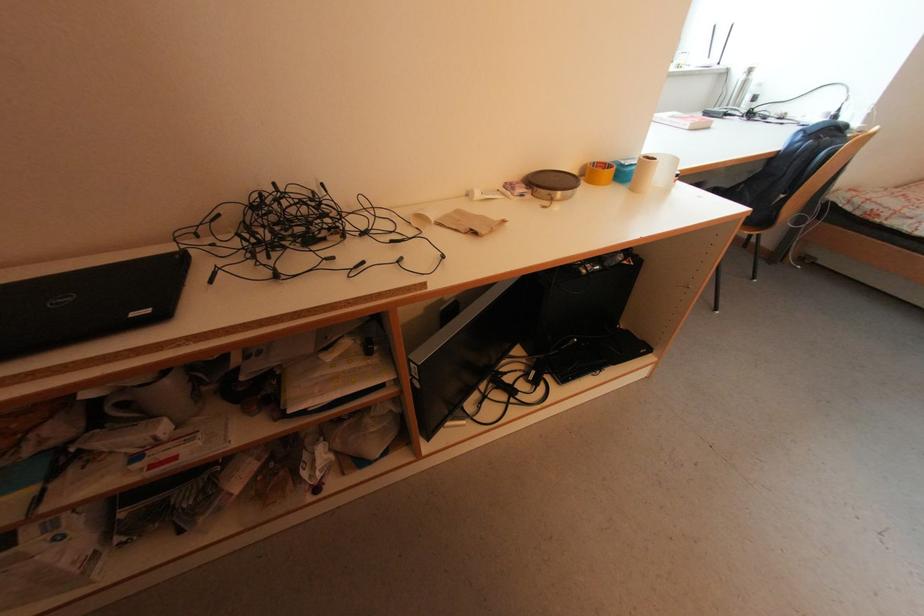
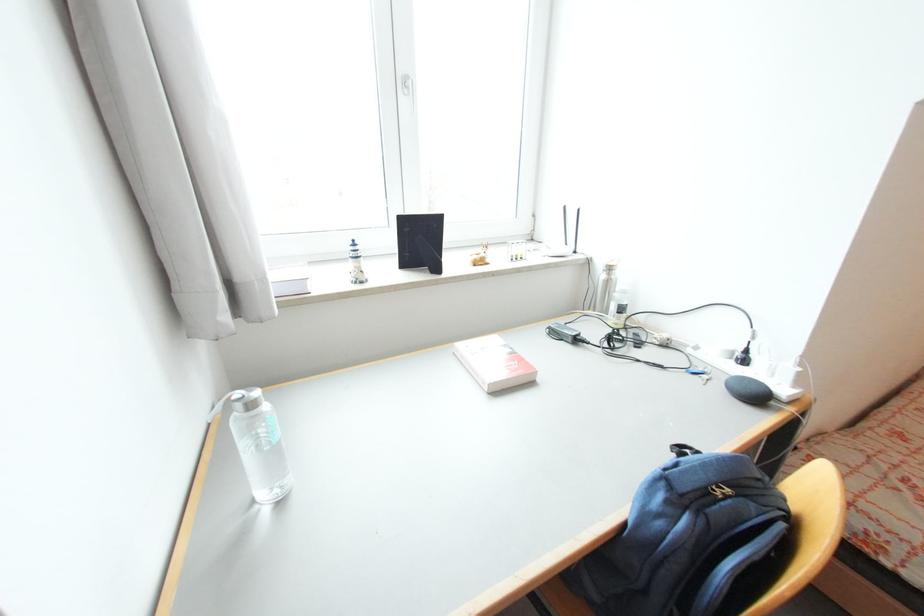
Find the pixel in the second image that matches [757,66] in the first image.

(614, 265)